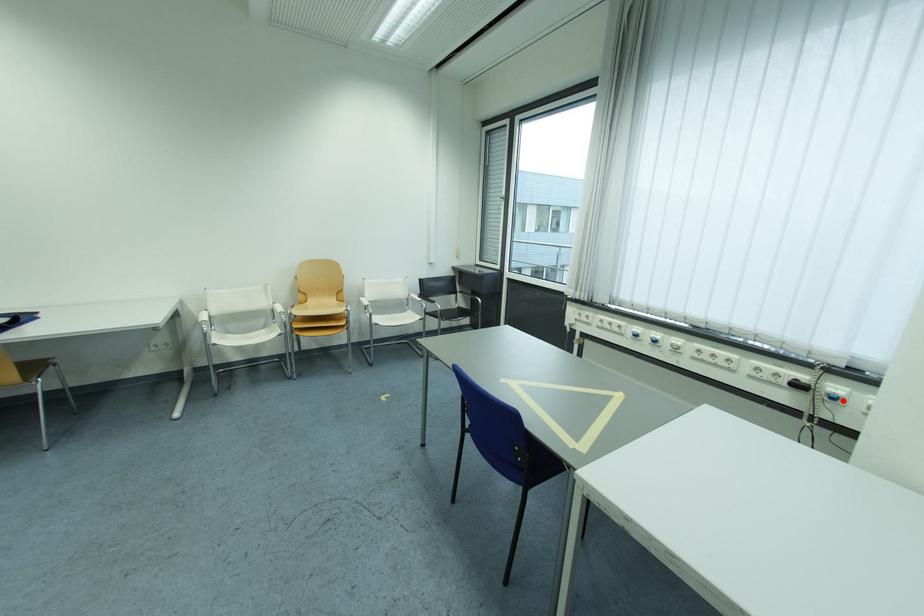
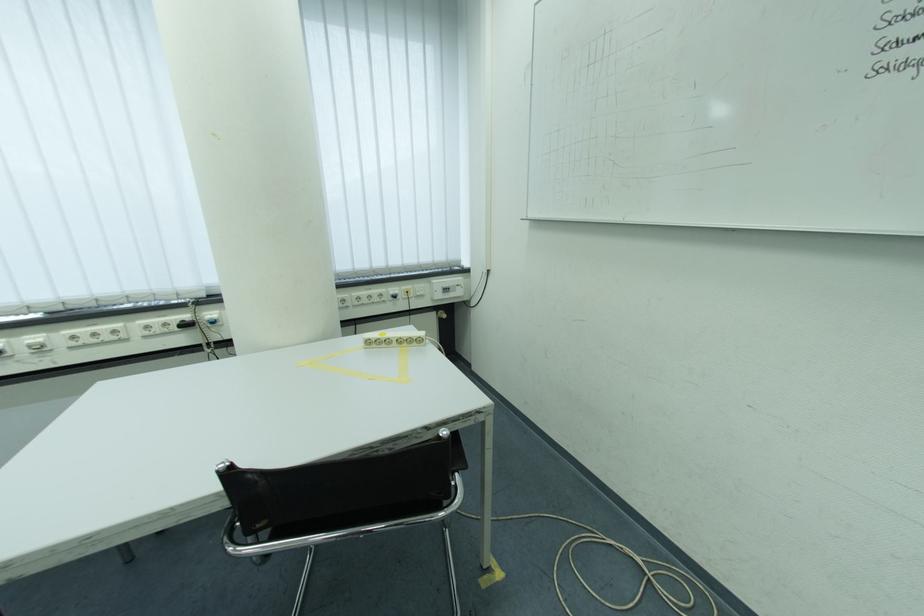
Locate, in the second image, the point that corresponds to the highlighted location in the first image.

(223, 325)